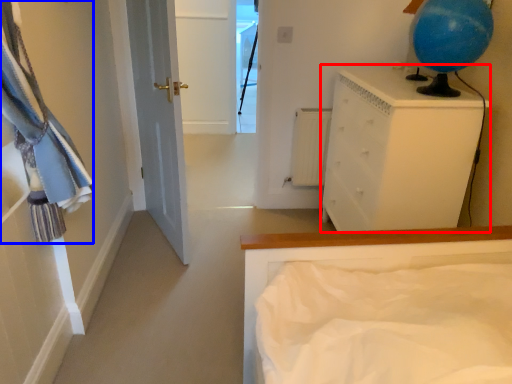
Question: Which object is further to the camera taking this photo, chest of drawers (highlighted by a red box) or laundry (highlighted by a blue box)?

Choices:
 (A) chest of drawers
 (B) laundry

Answer: (A)